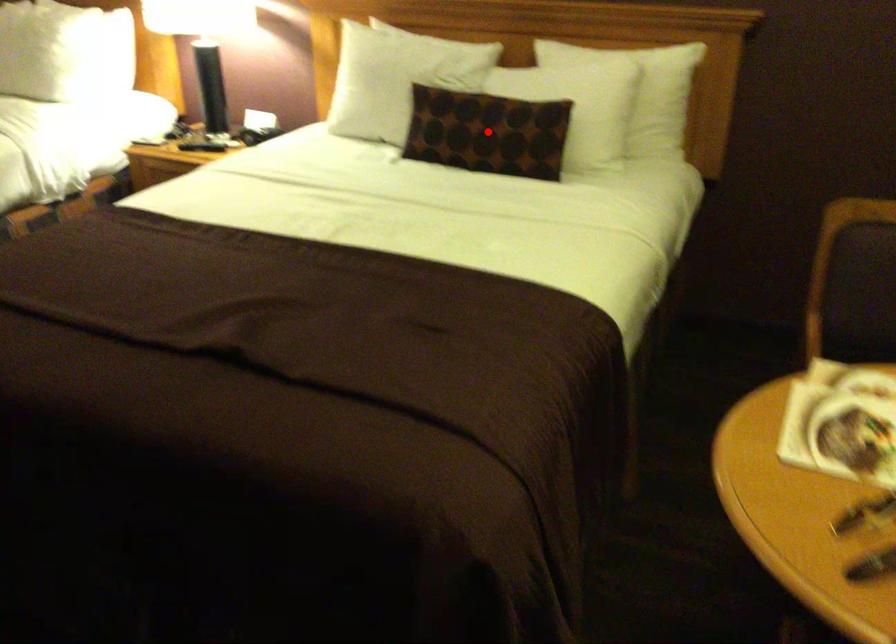
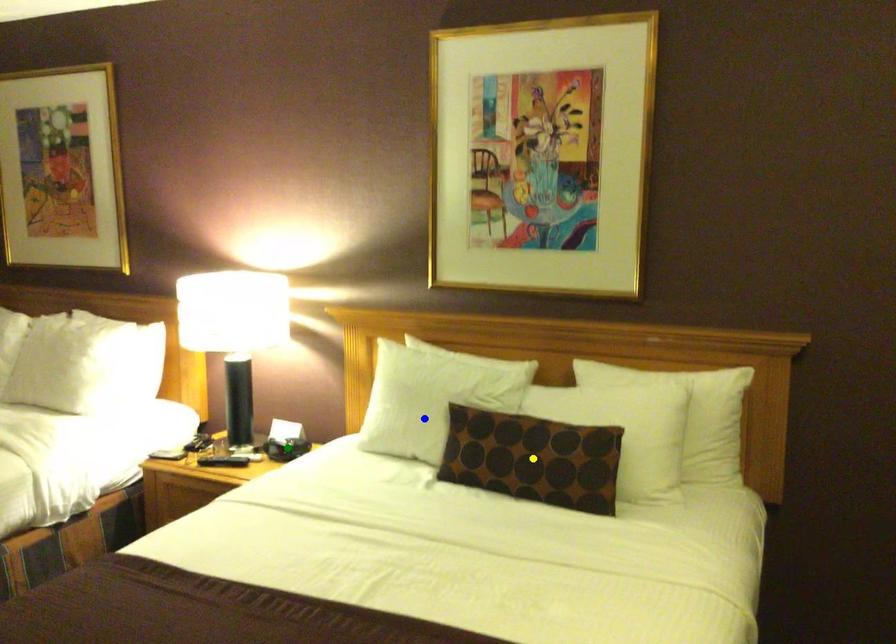
Question: I am providing you with two images of the same scene from different viewpoints. A red point is marked on the first image. You are given multiple points on the second image. Can you choose the point in image 2 that corresponds to the point in image 1?

Choices:
 (A) blue point
 (B) yellow point
 (C) green point

Answer: (B)